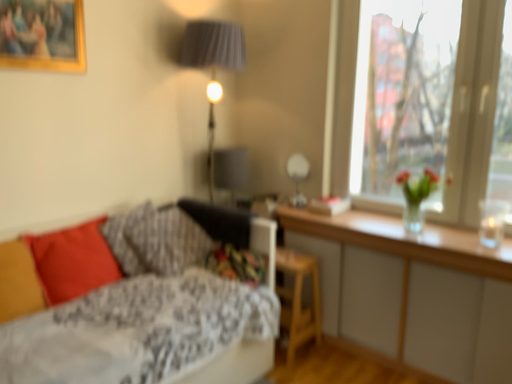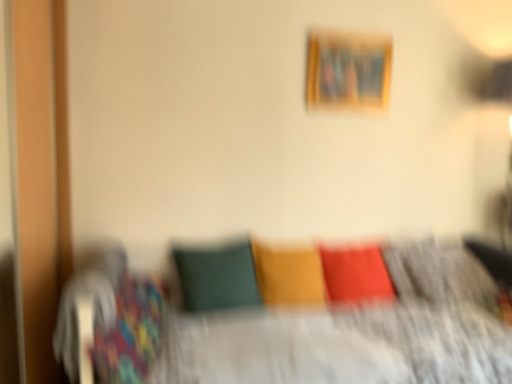
Question: Which way did the camera rotate in the video?

Choices:
 (A) rotated right
 (B) rotated left

Answer: (B)